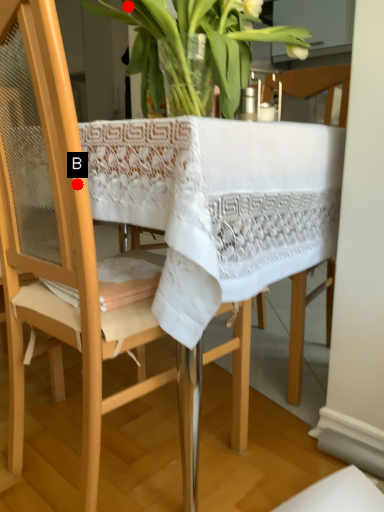
Question: Two points are circled on the image, labeled by A and B beside each circle. Which point appears closest to the camera in this image?

Choices:
 (A) A is closer
 (B) B is closer

Answer: (B)